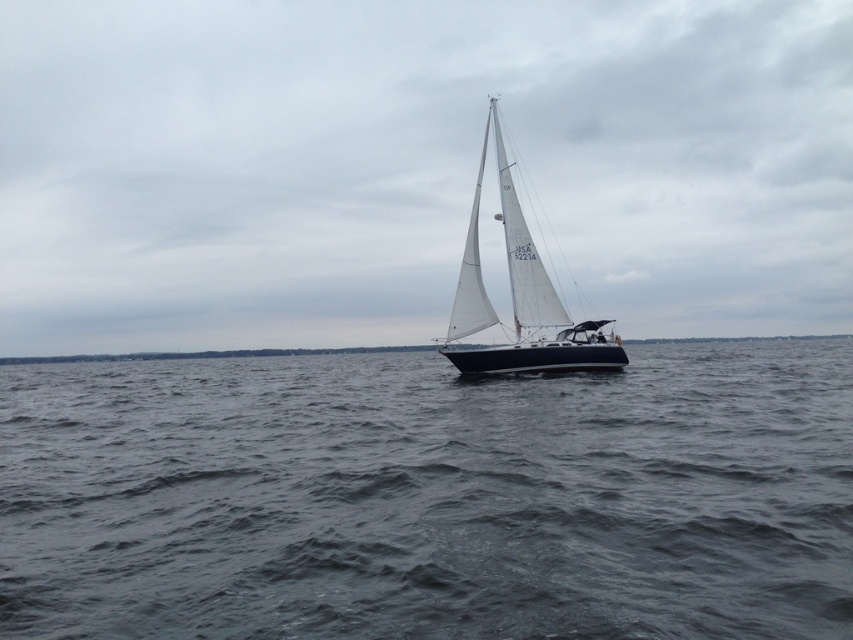
You are standing on the dock and see the dark gray water at center and the white matte sailboat at center. Which object is located below the other?

The dark gray water at center is positioned under the white matte sailboat at center, so the water is below the sailboat.

You are standing on the deck of a ship and see a point at coordinates point (567, 412). If you want to throw a lifebuoy to that point, and the lifebuoy can travel 15 meters, will it reach the point?

The point at coordinates point (567, 412) is 16.50 meters away from the viewer. Since the lifebuoy can only travel 15 meters, it will not reach the point.